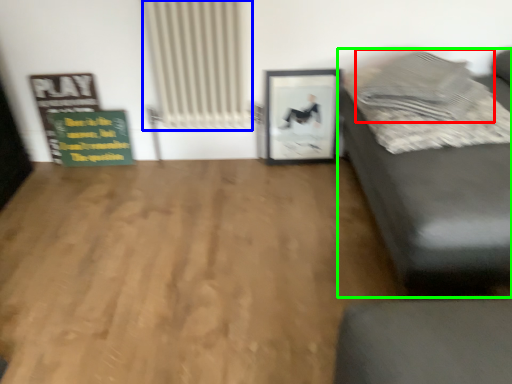
Question: Which object is positioned closest to pillow (highlighted by a red box)? Select from radiator (highlighted by a blue box) and studio couch (highlighted by a green box).

Choices:
 (A) radiator
 (B) studio couch

Answer: (B)